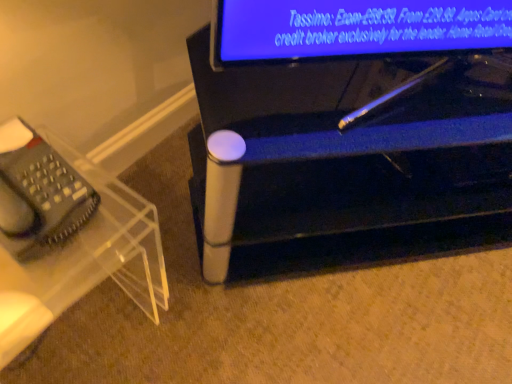
Find the location of a particular element. The width and height of the screenshot is (512, 384). vacant area that is in front of metallic silver pen at lower center, the 1th furniture from the right is located at coordinates (368, 324).